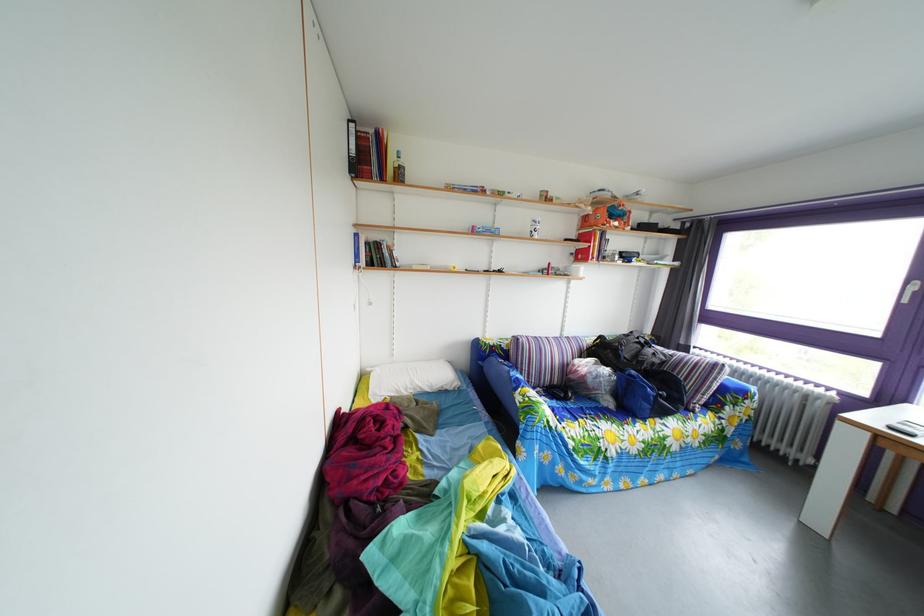
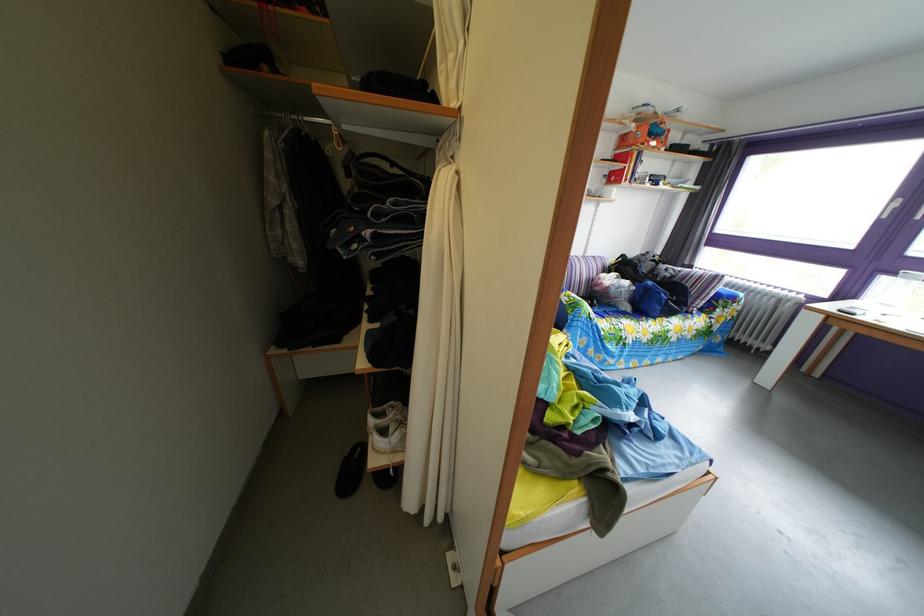
Where in the second image is the point corresponding to point (585, 259) from the first image?

(618, 180)